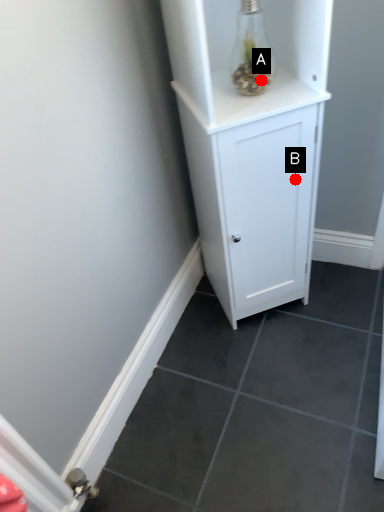
Question: Two points are circled on the image, labeled by A and B beside each circle. Among these points, which one is farthest from the camera?

Choices:
 (A) A is further
 (B) B is further

Answer: (B)